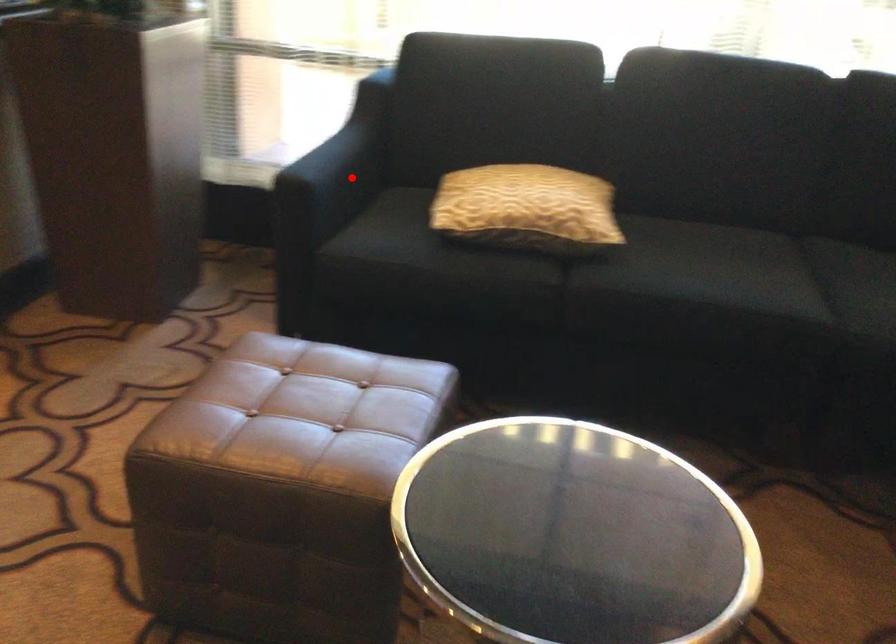
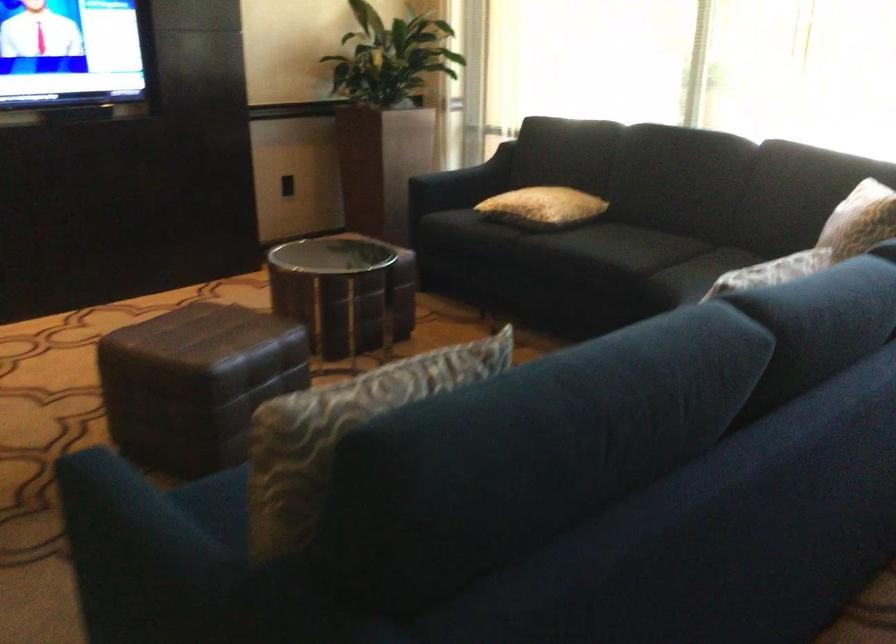
Question: A red point is marked in image1. In image2, is the corresponding 3D point closer to the camera or farther? Reply with the corresponding letter.

Choices:
 (A) The corresponding 3D point is closer.
 (B) The corresponding 3D point is farther.

Answer: (B)